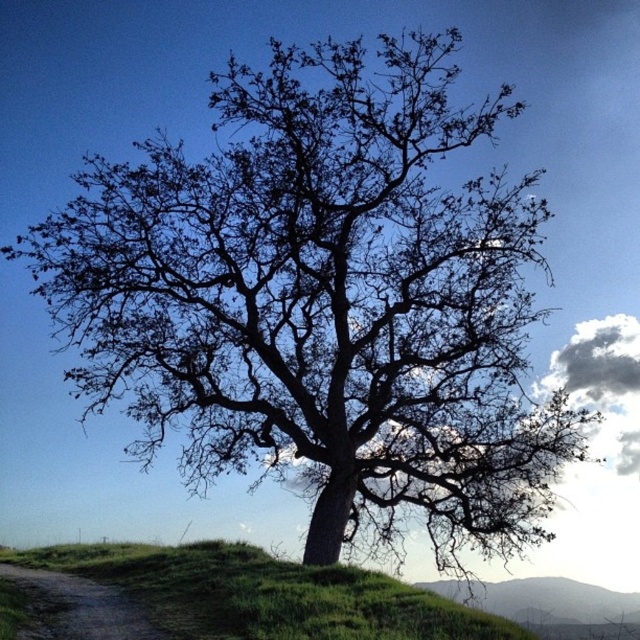
Question: Which of the following is the farthest from the observer?

Choices:
 (A) dirt/gravel path at lower left
 (B) green grassy hillside at lower right

Answer: (B)

Question: Which object is positioned closest to the green grassy hill at lower center?

Choices:
 (A) green grassy hillside at lower right
 (B) dirt/gravel path at lower left

Answer: (B)

Question: Which is nearer to the green grassy hillside at lower right?

Choices:
 (A) green grassy hill at lower center
 (B) dirt/gravel path at lower left

Answer: (A)

Question: Can you confirm if green grassy hill at lower center is bigger than green grassy hillside at lower right?

Choices:
 (A) yes
 (B) no

Answer: (B)

Question: Does green grassy hill at lower center appear over green grassy hillside at lower right?

Choices:
 (A) yes
 (B) no

Answer: (A)

Question: From the image, what is the correct spatial relationship of green grassy hill at lower center in relation to dirt/gravel path at lower left?

Choices:
 (A) above
 (B) below

Answer: (A)